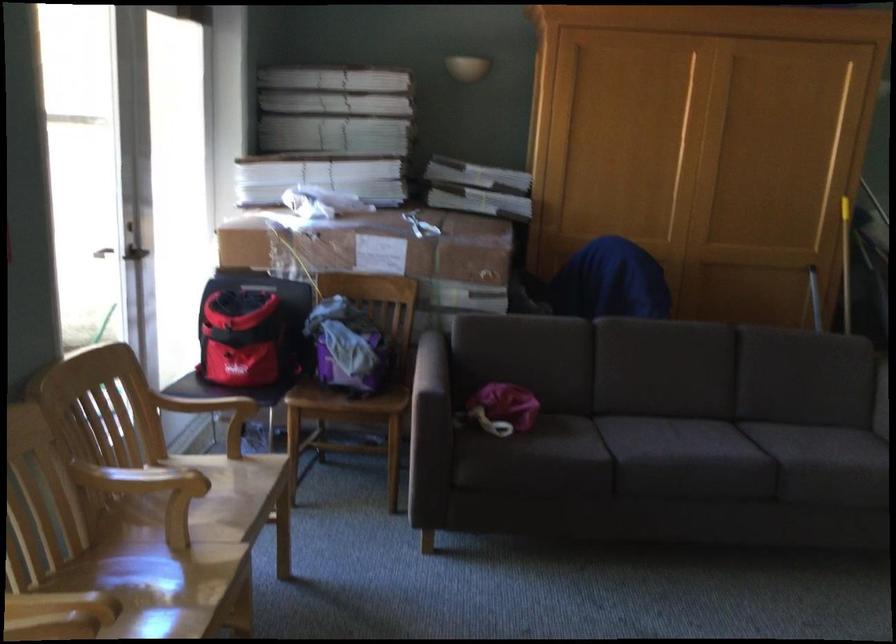
Image resolution: width=896 pixels, height=644 pixels. What do you see at coordinates (724, 439) in the screenshot?
I see `the sofa sitting surface` at bounding box center [724, 439].